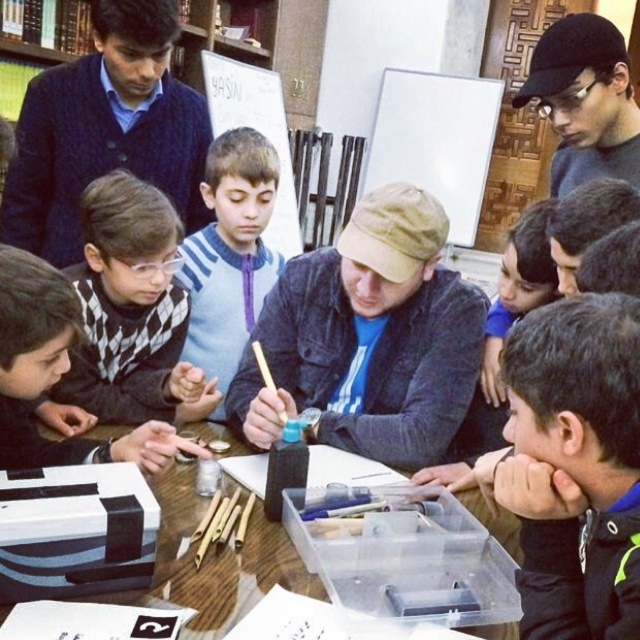
Can you confirm if dark blue sweater at upper left is shorter than wooden table at center?

Incorrect, dark blue sweater at upper left's height does not fall short of wooden table at center's.

Is dark blue sweater at upper left behind wooden table at center?

Yes, it is behind wooden table at center.

What are the coordinates of `dark blue sweater at upper left` in the screenshot? It's located at (106, 129).

Who is more distant from viewer, (532, 408) or (76, 401)?

The point (76, 401) is more distant.

Does dark blue fleece at lower right have a lesser width compared to black checkered sweater at lower left?

Yes.

The height and width of the screenshot is (640, 640). Find the location of `dark blue fleece at lower right`. dark blue fleece at lower right is located at coordinates (576, 467).

What do you see at coordinates (125, 312) in the screenshot?
I see `black checkered sweater at lower left` at bounding box center [125, 312].

Does point (140, 240) lie behind point (531, 70)?

That is False.

Which is in front, point (177, 387) or point (616, 173)?

Positioned in front is point (177, 387).

The width and height of the screenshot is (640, 640). Identify the location of black checkered sweater at lower left. (125, 312).